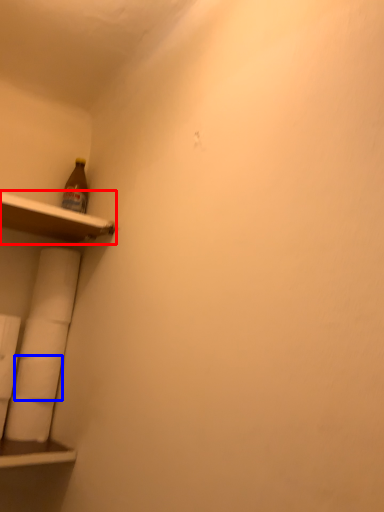
Question: Among these objects, which one is nearest to the camera, shelf (highlighted by a red box) or toilet paper (highlighted by a blue box)?

Choices:
 (A) shelf
 (B) toilet paper

Answer: (A)